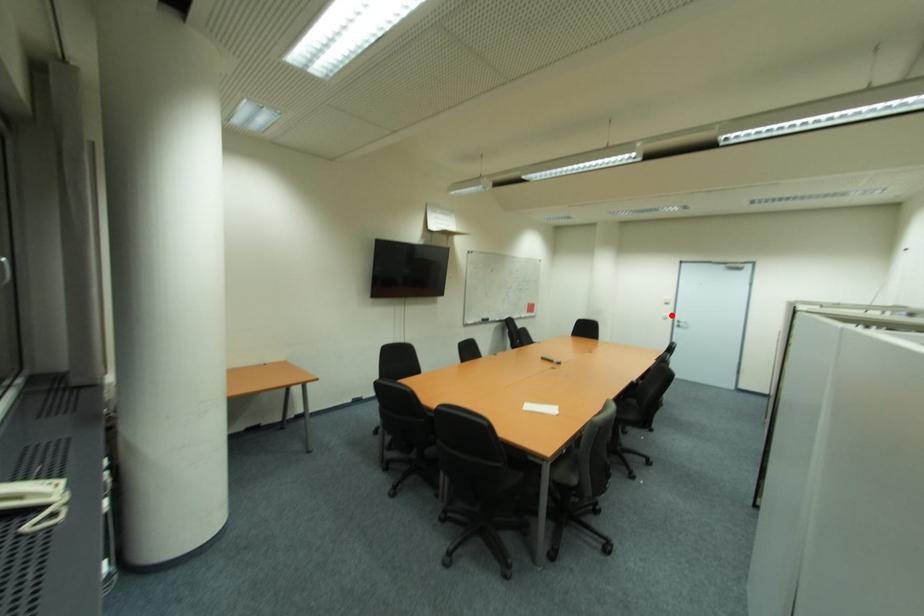
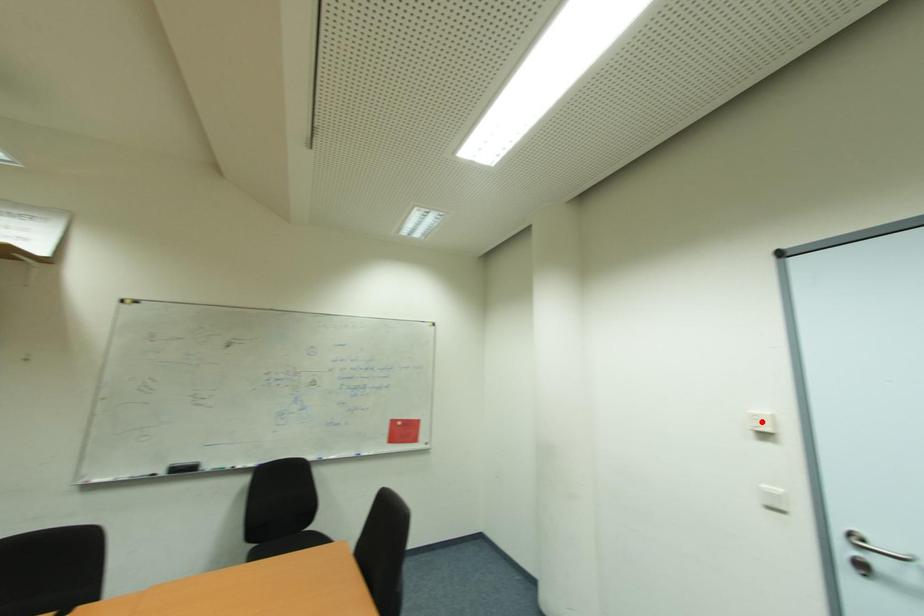
In the scene shown: I am providing you with two images of the same scene from different viewpoints. A red point is marked on the first image and another point is marked on the second image. Is the marked point in image1 the same physical position as the marked point in image2?

No